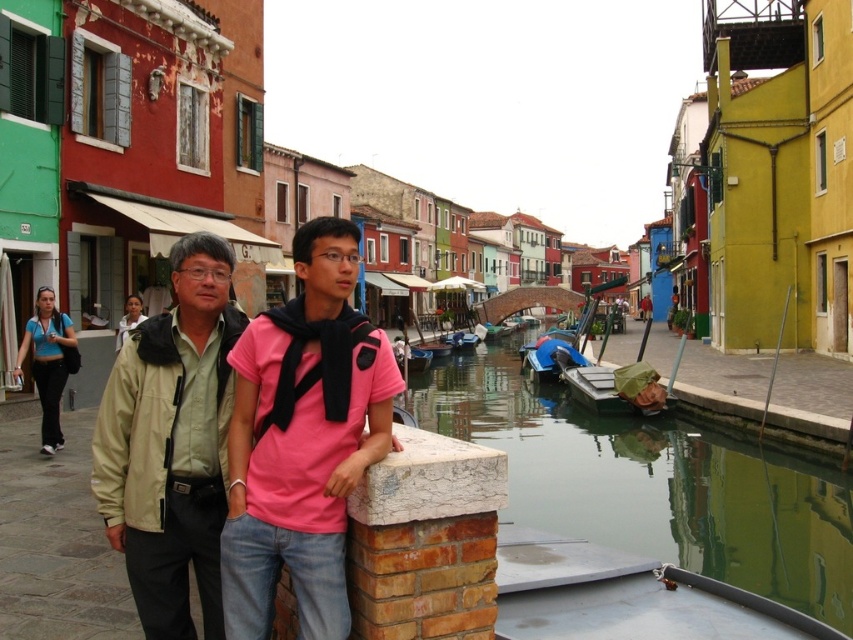
You are a tourist standing on the canal side and want to take a photo of the green reflective water at lower center and the metallic silver boat at lower right. Which object should you frame first in your camera to ensure both are captured in the same shot?

You should frame the green reflective water at lower center first because it is positioned on the left side of the metallic silver boat at lower right, so capturing the left side first will include both objects in the frame.

You are a photographer trying to capture both the blue athletic wear at left and the white fabric shirt at left in a single shot. Which of the two should you focus on first to ensure they are both in frame?

The blue athletic wear at left is much taller than the white fabric shirt at left, so focusing on the taller one first would help ensure both are in frame.